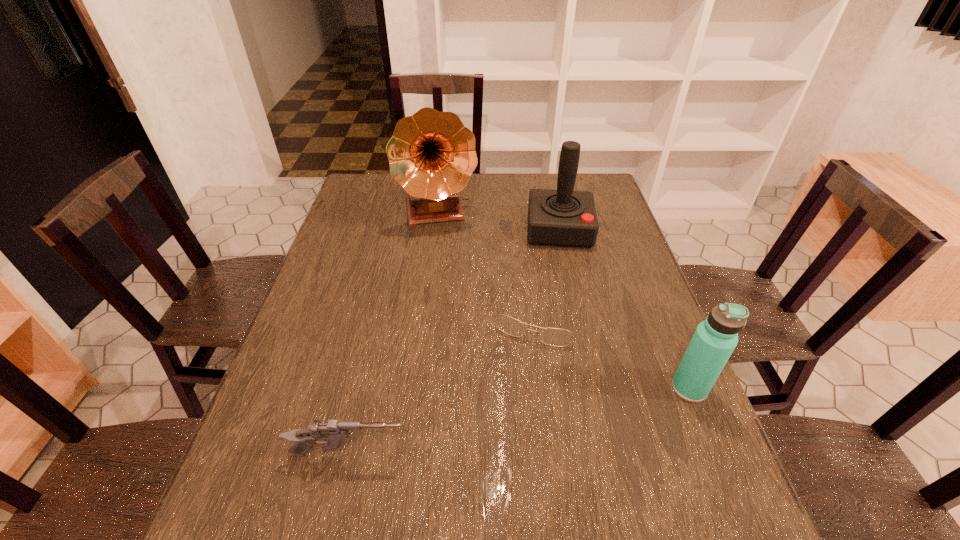
At what (x,y) coordinates should I click in order to perform the action: click on object at the near edge. Please return your answer as a coordinate pair (x, y). The height and width of the screenshot is (540, 960). Looking at the image, I should click on (333, 433).

This screenshot has width=960, height=540. In order to click on object located at the left edge in this screenshot , I will do `click(333, 433)`.

Where is `thermos bottle present at the right edge`? The image size is (960, 540). thermos bottle present at the right edge is located at coordinates (714, 340).

What are the coordinates of `joystick located at the right edge` in the screenshot? It's located at (563, 217).

Find the location of a particular element. This screenshot has width=960, height=540. object located in the near left corner section of the desktop is located at coordinates (333, 433).

The width and height of the screenshot is (960, 540). In the image, there is a desktop. Identify the location of vacant space at the near edge. click(451, 451).

This screenshot has height=540, width=960. I want to click on blank area at the left edge, so (313, 338).

The image size is (960, 540). Identify the location of vacant space at the right edge of the desktop. (629, 357).

You are a GUI agent. You are given a task and a screenshot of the screen. Output one action in this format:
    pyautogui.click(x=<x>, y=<y>)
    Task: Click on the vacant region at the near left corner of the desktop
    The image size is (960, 540).
    Given the screenshot: What is the action you would take?
    pyautogui.click(x=237, y=484)

Identify the location of free space at the far right corner. The height and width of the screenshot is (540, 960). (605, 187).